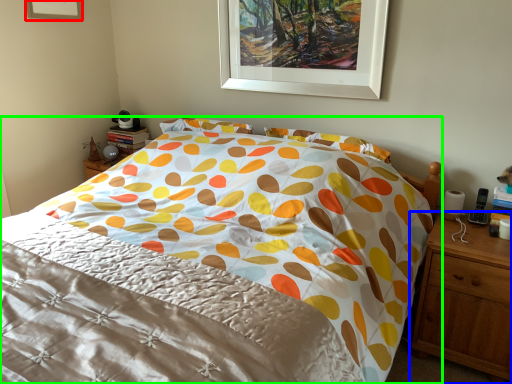
Question: Estimate the real-world distances between objects in this image. Which object is farther from picture frame (highlighted by a red box), nightstand (highlighted by a blue box) or bed (highlighted by a green box)?

Choices:
 (A) nightstand
 (B) bed

Answer: (A)